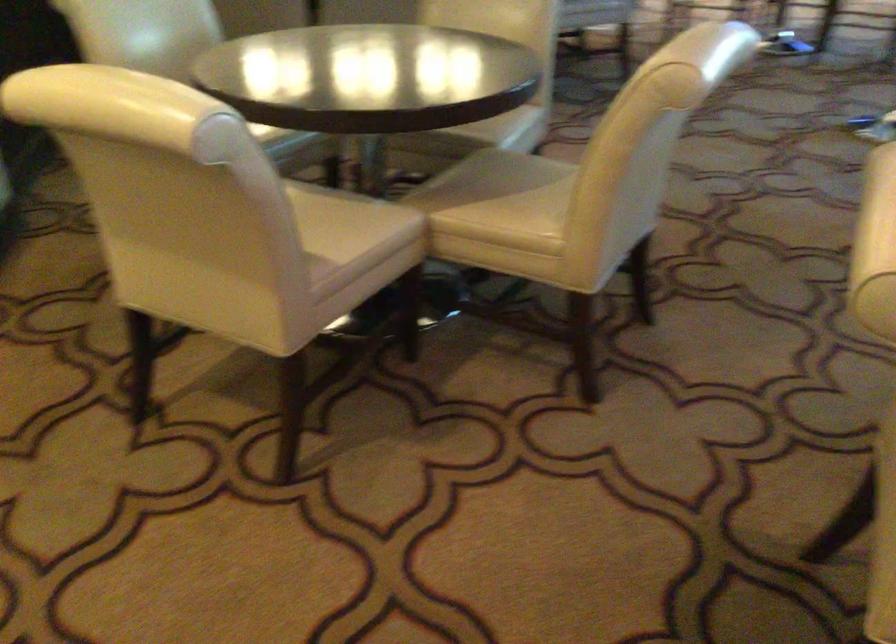
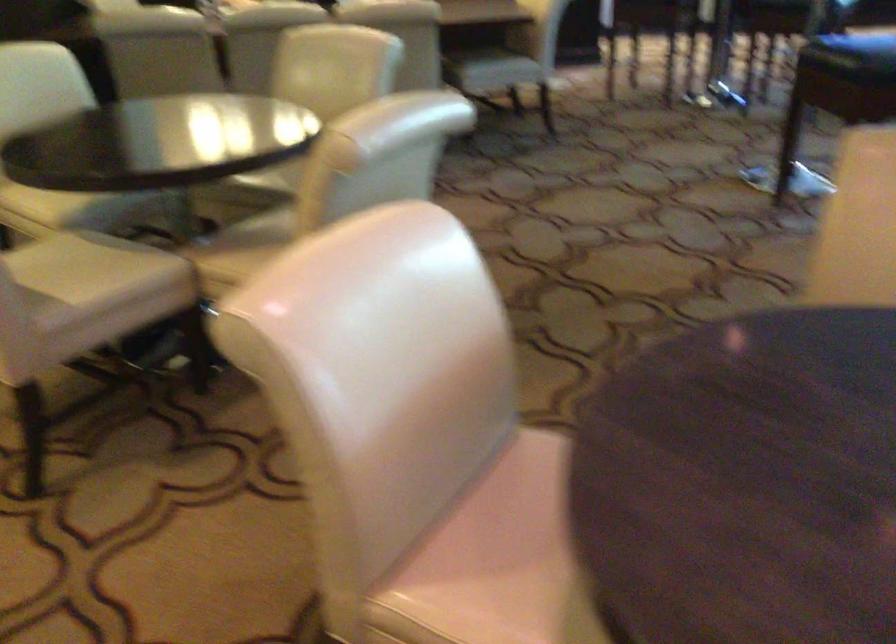
Question: In a continuous first-person perspective shot, in which direction is the camera moving?

Choices:
 (A) Left
 (B) Right
 (C) Forward
 (D) Backward

Answer: (B)